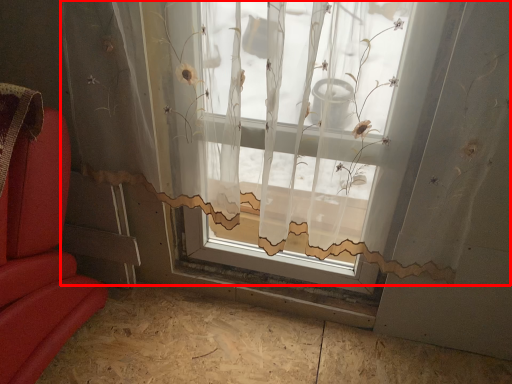
Question: Where is window (annotated by the red box) located in relation to plywood in the image?

Choices:
 (A) left
 (B) right

Answer: (A)